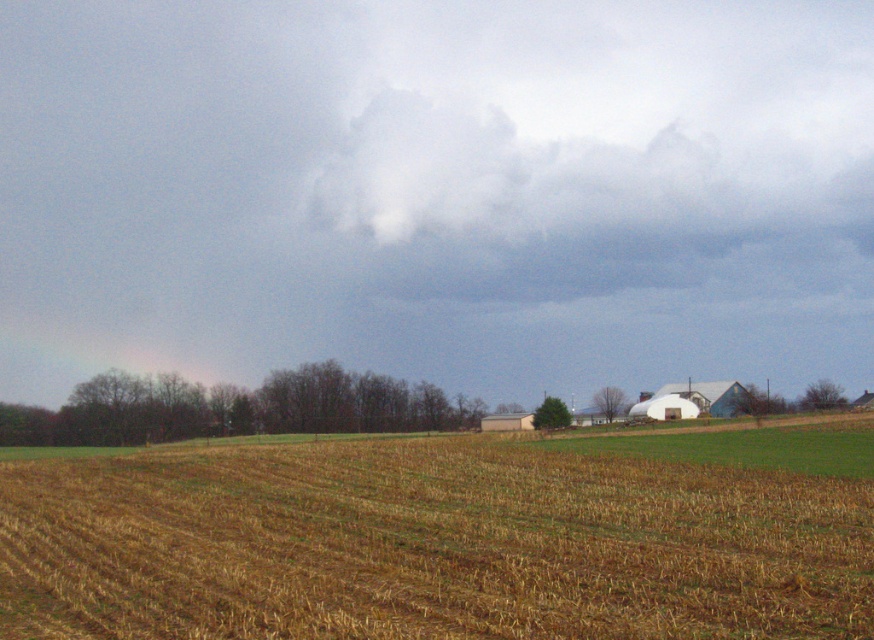
Question: Can you confirm if white fluffy cloud at upper center is bigger than brown straw at center?

Choices:
 (A) no
 (B) yes

Answer: (B)

Question: Which object appears farthest from the camera in this image?

Choices:
 (A) white fluffy cloud at upper center
 (B) brown straw at center

Answer: (A)

Question: Can you confirm if white fluffy cloud at upper center is thinner than brown straw at center?

Choices:
 (A) no
 (B) yes

Answer: (A)

Question: Does white fluffy cloud at upper center appear on the left side of brown straw at center?

Choices:
 (A) no
 (B) yes

Answer: (B)

Question: Which of the following is the closest to the observer?

Choices:
 (A) (806, 605)
 (B) (615, 38)

Answer: (A)

Question: Among these points, which one is nearest to the camera?

Choices:
 (A) (611, 477)
 (B) (220, 20)

Answer: (A)